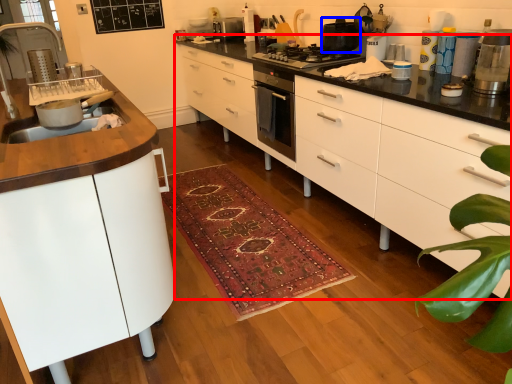
Question: Which object is closer to the camera taking this photo, chest of drawers (highlighted by a red box) or kitchen appliance (highlighted by a blue box)?

Choices:
 (A) chest of drawers
 (B) kitchen appliance

Answer: (A)